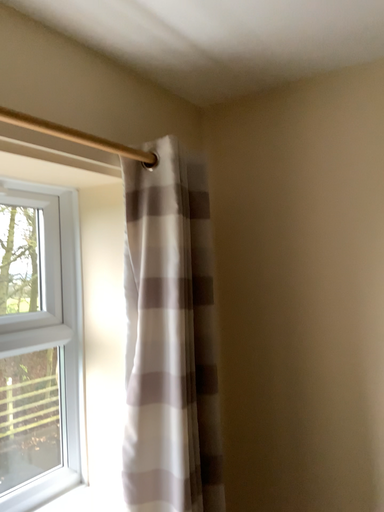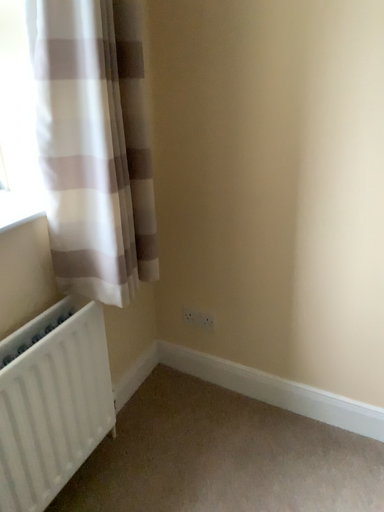
Question: How did the camera likely rotate when shooting the video?

Choices:
 (A) rotated left
 (B) rotated right

Answer: (B)